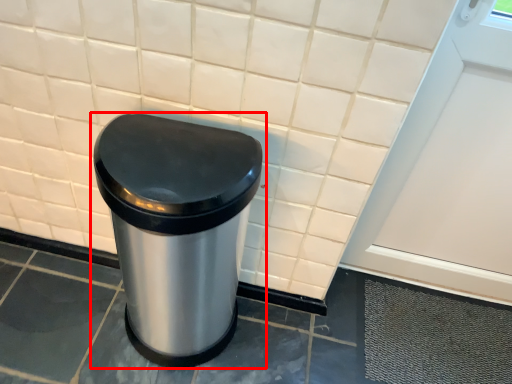
Question: In this image, where is waste container (annotated by the red box) located relative to screen door?

Choices:
 (A) left
 (B) right

Answer: (A)